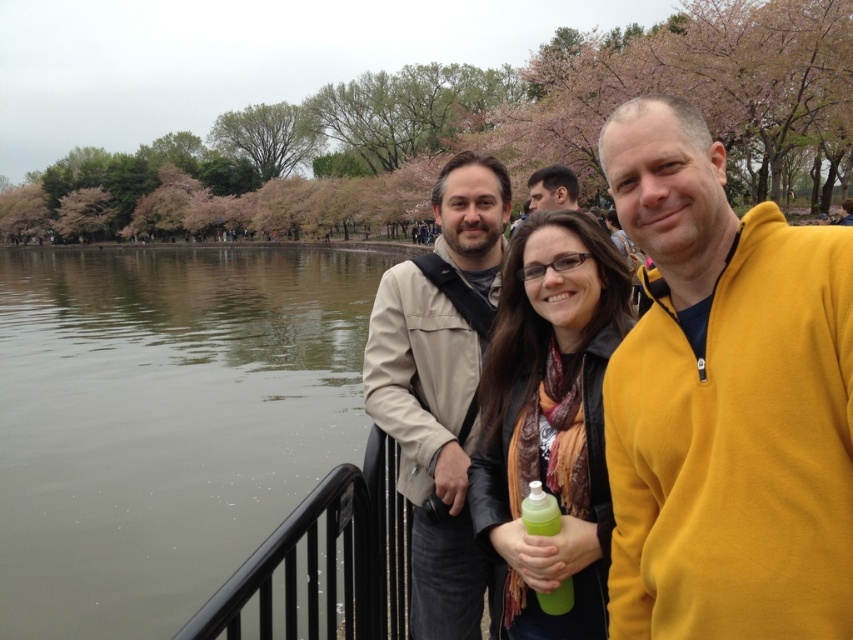
Question: Observing the image, what is the correct spatial positioning of greenish water at railing left in reference to beige fabric jacket at center?

Choices:
 (A) above
 (B) below

Answer: (A)

Question: Is greenish water at railing left above yellow fleece jacket at center?

Choices:
 (A) yes
 (B) no

Answer: (A)

Question: Is beige fabric jacket at center below green translucent bottle at center?

Choices:
 (A) no
 (B) yes

Answer: (A)

Question: Among these objects, which one is farthest from the camera?

Choices:
 (A) leather jacket at center
 (B) beige fabric jacket at center
 (C) green translucent bottle at center
 (D) yellow fleece jacket at center

Answer: (B)

Question: Which of the following is the farthest from the observer?

Choices:
 (A) (376, 378)
 (B) (564, 179)

Answer: (B)

Question: Estimate the real-world distances between objects in this image. Which object is closer to the green translucent bottle at center?

Choices:
 (A) matte black jacket at upper center
 (B) beige fabric jacket at center
 (C) black metal railing at lower center
 (D) leather jacket at center

Answer: (D)